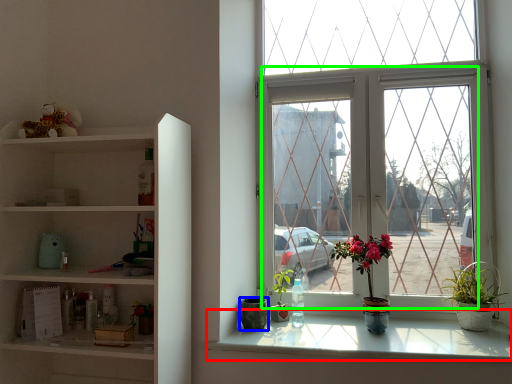
Question: Considering the real-world distances, which object is closest to window sill (highlighted by a red box)? flowerpot (highlighted by a blue box) or glass window (highlighted by a green box).

Choices:
 (A) flowerpot
 (B) glass window

Answer: (A)